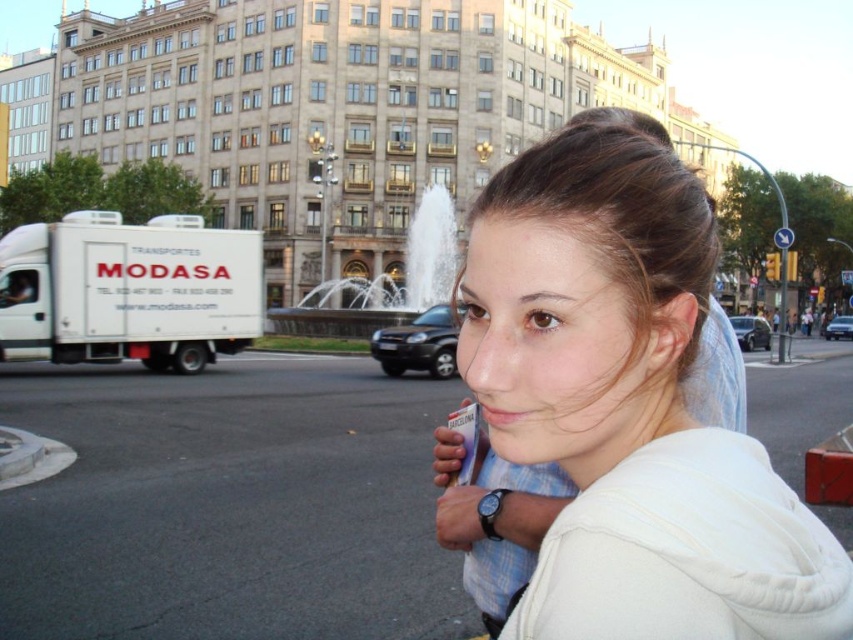
You are a photographer standing in the plaza. You want to take a photo of the woman in the white cotton hoodie at center and her brown smooth hair at center. Which part of her should appear larger in the photo?

→ The white cotton hoodie at center will appear larger in the photo because it is closer to the viewer than the brown smooth hair at center.

You are a fashion designer observing the woman in the image. Which item of clothing or accessory is thinner between the white cotton hoodie at center and the brown smooth hair at center?

The white cotton hoodie at center is thinner than the brown smooth hair at center according to the description.

What object is located at the coordinates point (x=630, y=406)?

The point (x=630, y=406) corresponds to the white cotton hoodie at center.